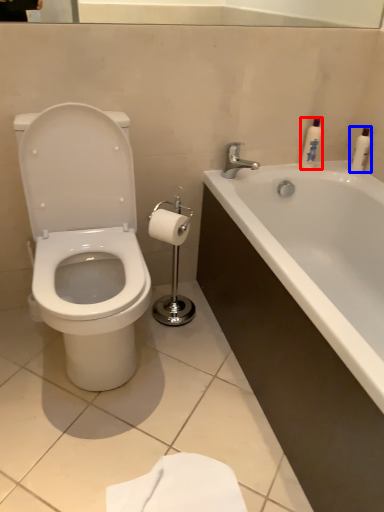
Question: Which of the following is the farthest to the observer, toiletry (highlighted by a red box) or toiletry (highlighted by a blue box)?

Choices:
 (A) toiletry
 (B) toiletry

Answer: (B)